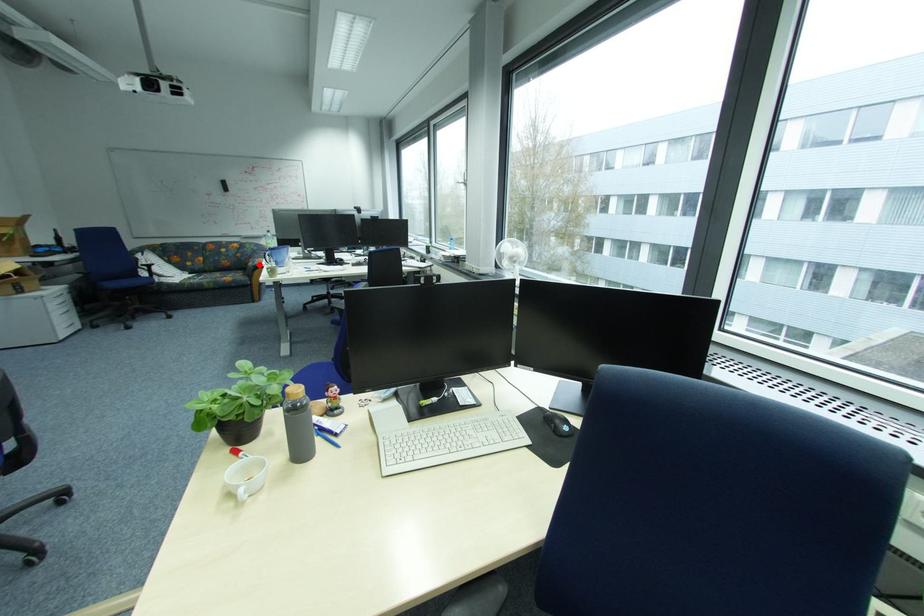
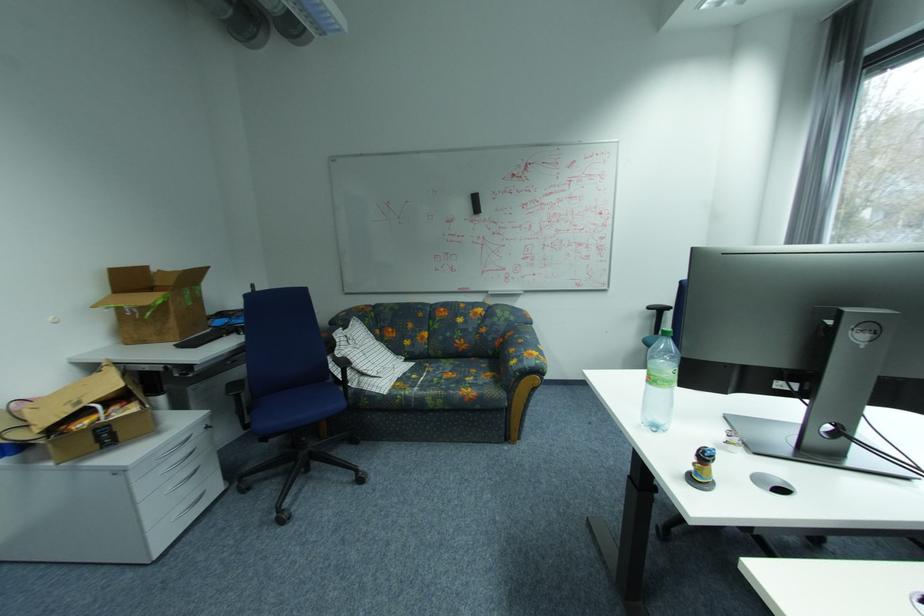
Question: I am providing you with two images of the same scene from different viewpoints. Given a red point in image1, look at the same physical point in image2. Is it:

Choices:
 (A) Closer to the viewpoint
 (B) Farther from the viewpoint

Answer: (A)